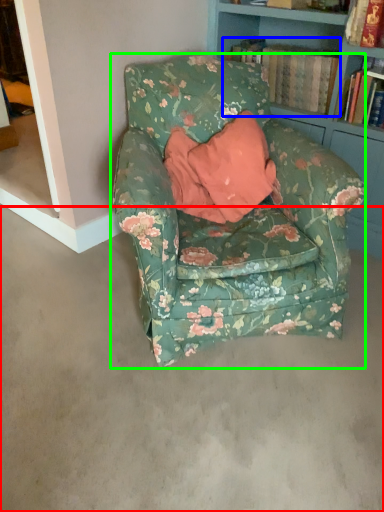
Question: Estimate the real-world distances between objects in this image. Which object is closer to concrete (highlighted by a red box), book (highlighted by a blue box) or chair (highlighted by a green box)?

Choices:
 (A) book
 (B) chair

Answer: (B)